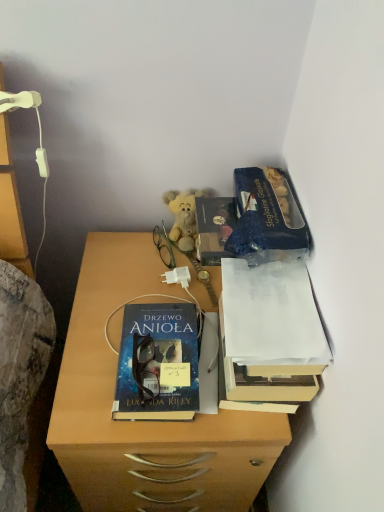
Locate an element on the screen. vacant space to the left of white paper at upper right, which ranks as the 1th book in right-to-left order is located at coordinates (138, 304).